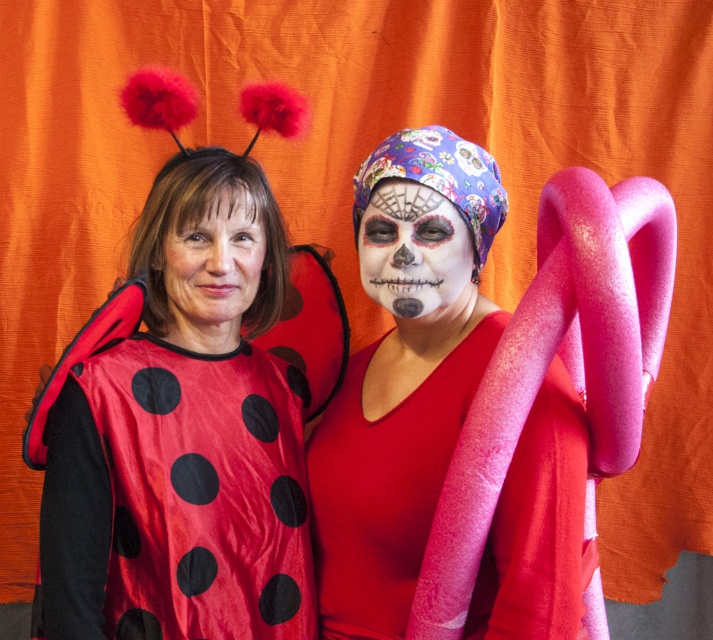
You are a costume designer trying to place a new accessory at point (185,435). Which costume will the accessory be placed on?

The accessory will be placed on the matte fabric ladybug costume at left, as it is located at point (185,435).

You are standing in front of the backdrop and want to take a photo of the point at coordinates point (414, 451). If your camera has a focal length of 50mm and you want to ensure the point is in focus, what is the minimum distance you need to be from the backdrop?

The point at point (414, 451) is 1.37 meters away from the camera, so the minimum distance you need to be from the backdrop is 1.37 meters to ensure the point is in focus.

You are a costume designer preparing for a photoshoot. You need to position the matte fabric ladybug costume at left and the smooth matte skin at center so that they are exactly 10 centimeters apart. Can you adjust their current positions to meet this requirement?

The current distance between the matte fabric ladybug costume at left and the smooth matte skin at center is 12.38 centimeters. To achieve the desired 10 centimeters, you need to move them closer by 2.38 centimeters.